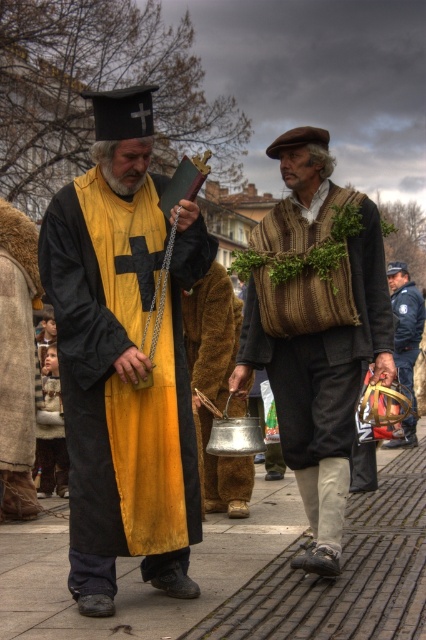
Is point (6, 531) closer to viewer compared to point (293, 400)?

No, (6, 531) is behind (293, 400).

Does brick pavement at lower center have a smaller size compared to brown woven basket at center?

Indeed, brick pavement at lower center has a smaller size compared to brown woven basket at center.

Is point (408, 522) farther from viewer compared to point (256, 301)?

Yes, it is.

At what (x,y) coordinates should I click in order to perform the action: click on brick pavement at lower center. Please return your answer as a coordinate pair (x, y). The image size is (426, 640). Looking at the image, I should click on (244, 573).

Who is positioned more to the right, brown woven basket at center or metallic silver pot at center?

brown woven basket at center

Image resolution: width=426 pixels, height=640 pixels. What do you see at coordinates (316, 333) in the screenshot? I see `brown woven basket at center` at bounding box center [316, 333].

Between point (290, 243) and point (198, 300), which one is positioned in front?

Point (290, 243)

The width and height of the screenshot is (426, 640). I want to click on brown woven basket at center, so click(316, 333).

Can you confirm if brown woven basket at center is bigger than metallic gold helmet at center?

Correct, brown woven basket at center is larger in size than metallic gold helmet at center.

Can you confirm if brown woven basket at center is positioned to the left of metallic gold helmet at center?

Yes, brown woven basket at center is to the left of metallic gold helmet at center.

Is point (340, 388) positioned after point (414, 320)?

No, (340, 388) is in front of (414, 320).

Find the location of a particular element. This screenshot has width=426, height=640. brown woven basket at center is located at coordinates (316, 333).